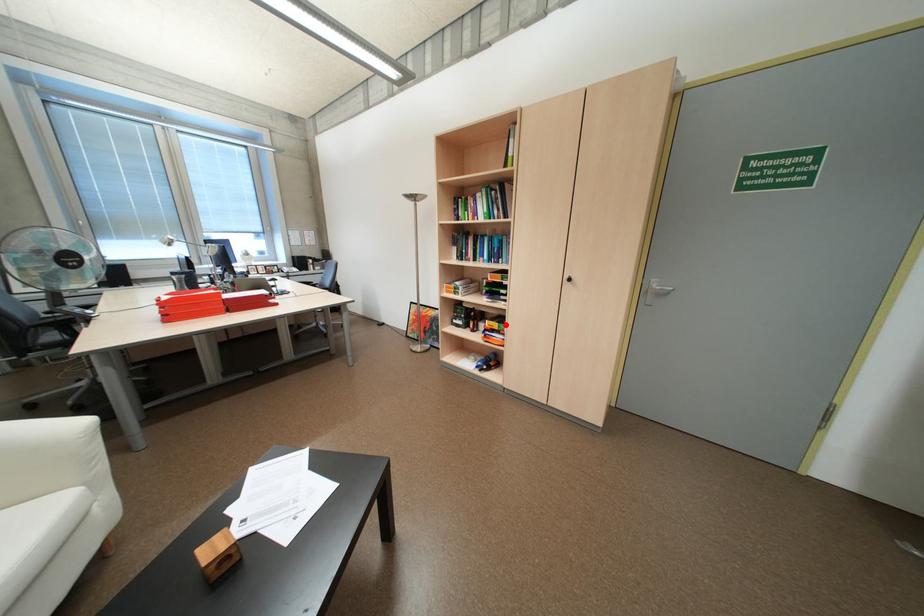
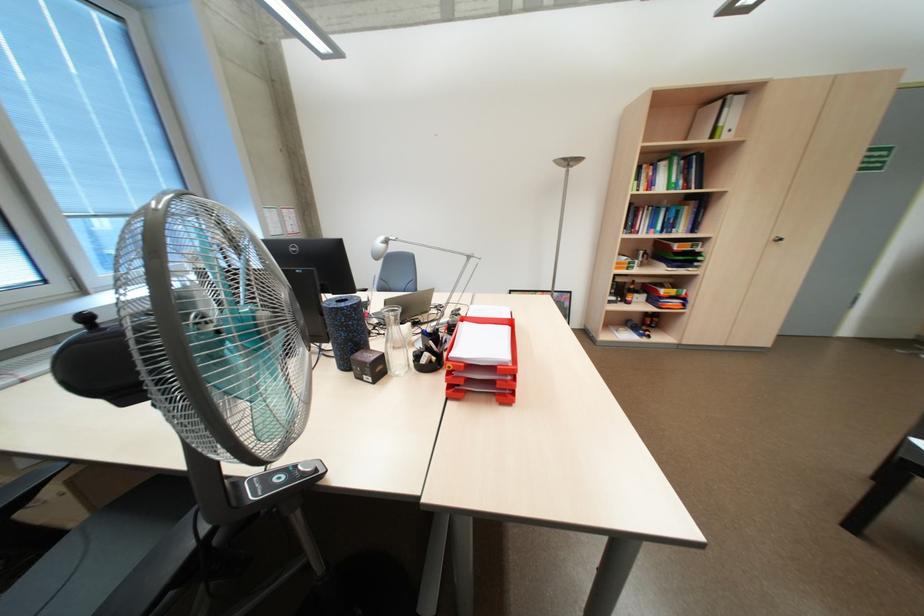
Question: I am providing you with two images of the same scene from different viewpoints. In image1, a red point is highlighted. Considering the same 3D point in image2, which of the following is correct?

Choices:
 (A) It is closer
 (B) It is farther

Answer: (A)